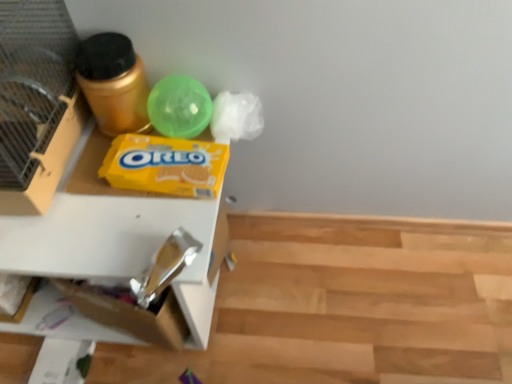
This screenshot has width=512, height=384. Identify the location of vacant space to the left of yellow cardboard oreo box at center. (73, 194).